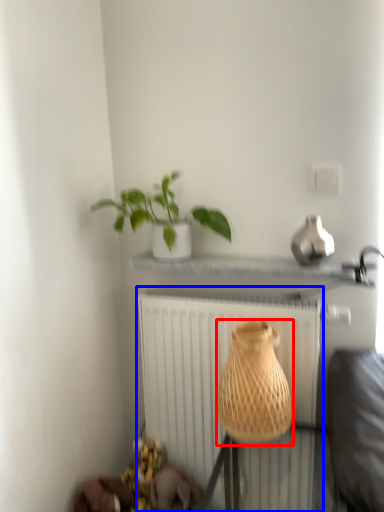
Question: Among these objects, which one is farthest to the camera, vase (highlighted by a red box) or radiator (highlighted by a blue box)?

Choices:
 (A) vase
 (B) radiator

Answer: (B)